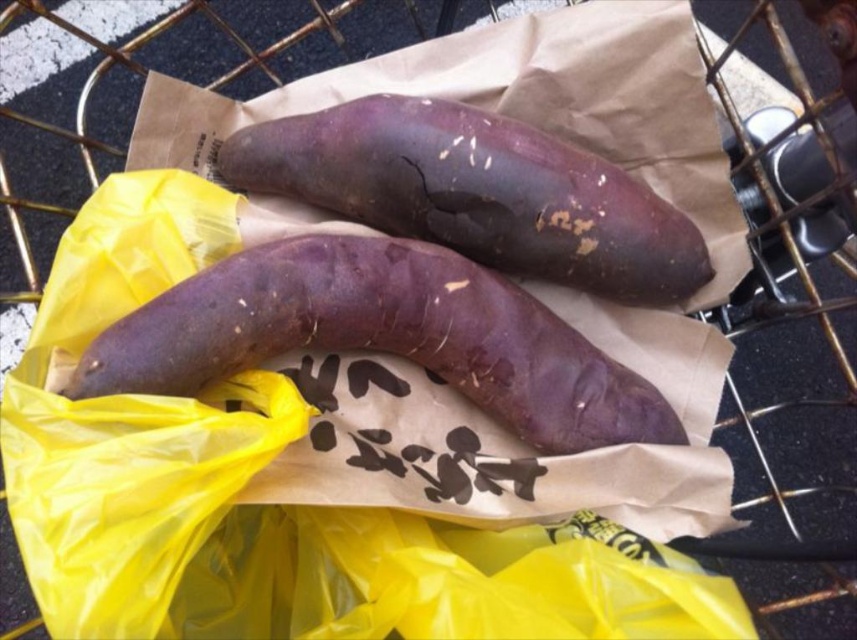
Question: Among these objects, which one is nearest to the camera?

Choices:
 (A) purple matte/skinny potato at center
 (B) purple matte sweet potato at center

Answer: (A)

Question: Which object appears closest to the camera in this image?

Choices:
 (A) purple matte/skinny potato at center
 (B) purple matte sweet potato at center

Answer: (A)

Question: Is the position of purple matte/skinny potato at center less distant than that of purple matte sweet potato at center?

Choices:
 (A) no
 (B) yes

Answer: (B)

Question: Where is purple matte/skinny potato at center located in relation to purple matte sweet potato at center in the image?

Choices:
 (A) left
 (B) right

Answer: (A)

Question: Can you confirm if purple matte/skinny potato at center is bigger than purple matte sweet potato at center?

Choices:
 (A) no
 (B) yes

Answer: (B)